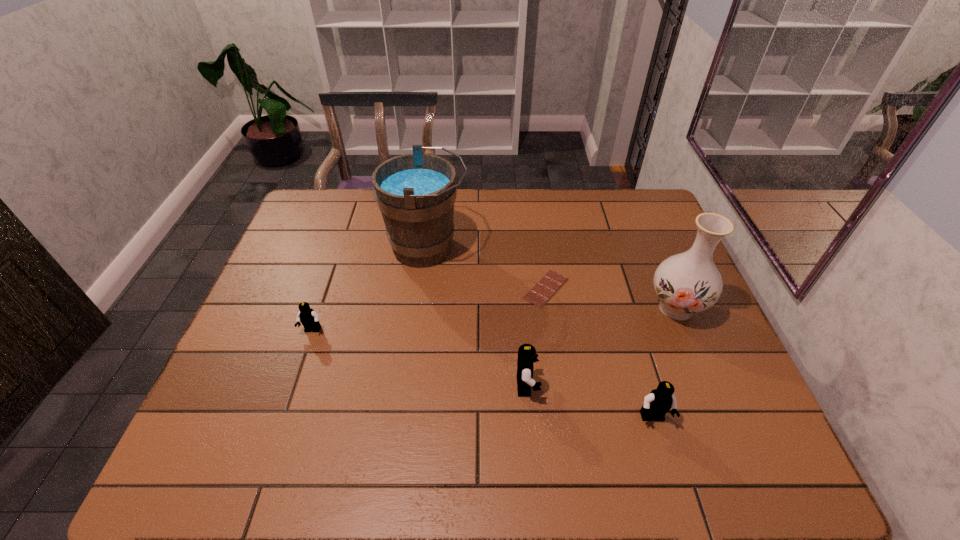
This screenshot has width=960, height=540. Find the location of `vacant space at the far left corner of the desktop`. vacant space at the far left corner of the desktop is located at coordinates (324, 219).

I want to click on free location at the near left corner, so click(274, 423).

Locate an element on the screen. The image size is (960, 540). free space at the far right corner is located at coordinates (647, 190).

This screenshot has width=960, height=540. What are the coordinates of `vacant point located between the second nearest Lego and the chocolate bar` in the screenshot? It's located at (537, 337).

At what (x,y) coordinates should I click in order to perform the action: click on vacant region between the leftmost Lego and the fifth object from right to left. Please return your answer as a coordinate pair (x, y). This screenshot has width=960, height=540. Looking at the image, I should click on (370, 289).

Locate an element on the screen. The height and width of the screenshot is (540, 960). blank region between the rightmost Lego and the second object from left to right is located at coordinates (540, 333).

Where is `free spot between the leftmost object and the wine bucket`? Image resolution: width=960 pixels, height=540 pixels. free spot between the leftmost object and the wine bucket is located at coordinates (370, 289).

Where is `vacant space that is in between the vase and the nearest Lego`? The image size is (960, 540). vacant space that is in between the vase and the nearest Lego is located at coordinates coord(664,363).

The image size is (960, 540). Find the location of `free space between the wine bucket and the farthest Lego`. free space between the wine bucket and the farthest Lego is located at coordinates (370, 289).

At what (x,y) coordinates should I click in order to perform the action: click on blank region between the wine bucket and the farthest Lego. Please return your answer as a coordinate pair (x, y). Looking at the image, I should click on (370, 289).